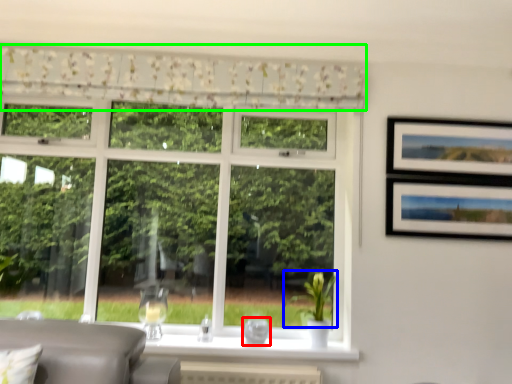
Question: Estimate the real-world distances between objects in this image. Which object is farther from glass vase (highlighted by a red box), plant (highlighted by a blue box) or curtain (highlighted by a green box)?

Choices:
 (A) plant
 (B) curtain

Answer: (B)